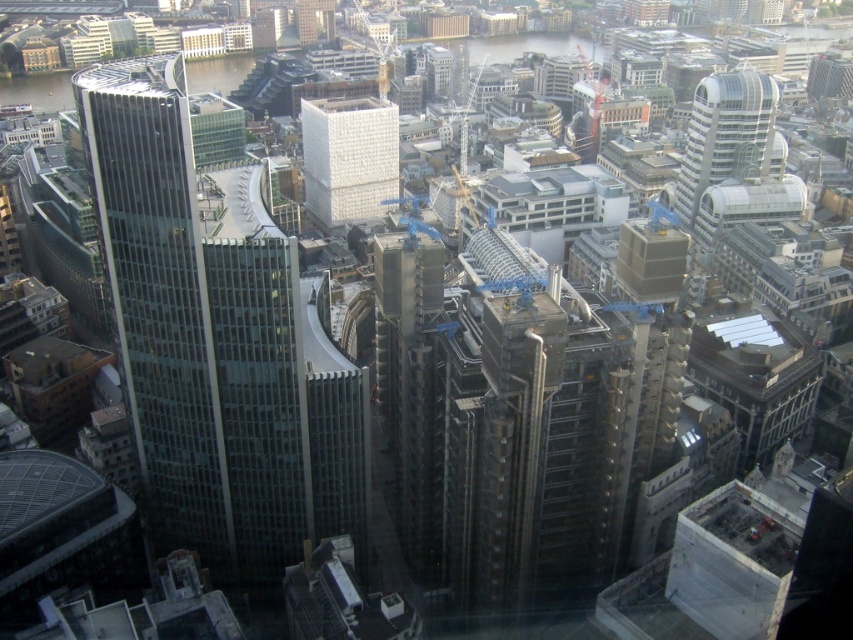
Is point (148, 58) farther from viewer compared to point (726, 116)?

No.

Between point (119, 134) and point (683, 166), which one is positioned behind?

Positioned behind is point (683, 166).

Image resolution: width=853 pixels, height=640 pixels. I want to click on glassy steel skyscraper at left, so click(x=160, y=298).

Is glassy steel skyscraper at left shorter than white textured cube at center?

No, glassy steel skyscraper at left is not shorter than white textured cube at center.

Does glassy steel skyscraper at left appear on the right side of white textured cube at center?

No, glassy steel skyscraper at left is not to the right of white textured cube at center.

Locate an element on the screen. The image size is (853, 640). glassy steel skyscraper at left is located at coordinates (160, 298).

This screenshot has width=853, height=640. Identify the location of glassy steel skyscraper at left. (160, 298).

Does point (316, 129) come in front of point (769, 148)?

Yes, point (316, 129) is in front of point (769, 148).

Does white textured cube at center appear on the right side of glassy silver tower at upper right?

Incorrect, white textured cube at center is not on the right side of glassy silver tower at upper right.

Where is `white textured cube at center`? white textured cube at center is located at coordinates (347, 157).